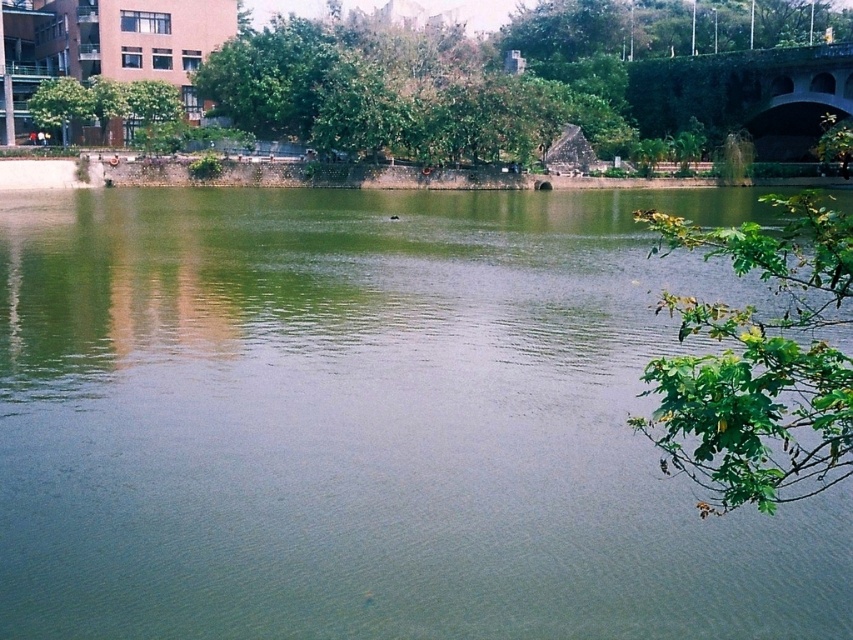
Identify the location of green leafy branch at right. The width and height of the screenshot is (853, 640). (758, 362).

Can you confirm if green leafy branch at right is taller than green concrete bridge at upper right?

Correct, green leafy branch at right is much taller as green concrete bridge at upper right.

Where is `green leafy branch at right`? green leafy branch at right is located at coordinates (758, 362).

In order to click on green leafy branch at right in this screenshot , I will do `click(758, 362)`.

Can you confirm if green leafy branch at right is smaller than green leafy tree at upper left?

No.

Which is more to the right, green leafy branch at right or green leafy tree at upper left?

Positioned to the right is green leafy branch at right.

Measure the distance between green leafy branch at right and camera.

green leafy branch at right and camera are 6.69 meters apart.

Find the location of `green leafy branch at right`. green leafy branch at right is located at coordinates (758, 362).

Is green smooth water at center shorter than green concrete bridge at upper right?

Yes.

Describe the element at coordinates (369, 422) in the screenshot. This screenshot has width=853, height=640. I see `green smooth water at center` at that location.

The height and width of the screenshot is (640, 853). What are the coordinates of `green smooth water at center` in the screenshot? It's located at (369, 422).